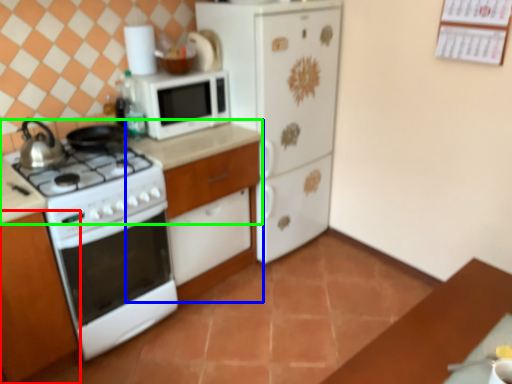
Question: Which is farther away from cabinetry (highlighted by a red box)? dresser (highlighted by a blue box) or counter top (highlighted by a green box)?

Choices:
 (A) dresser
 (B) counter top

Answer: (A)